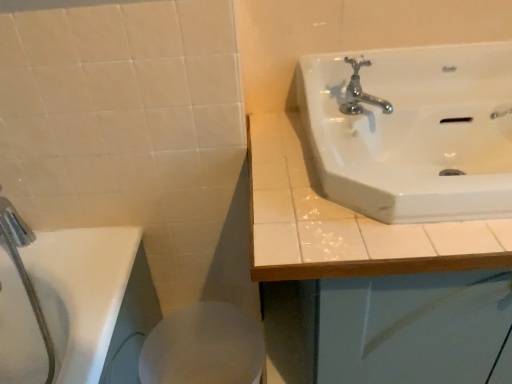
Question: Considering the relative positions of white glossy sink at upper right and white glossy sink at upper right in the image provided, is white glossy sink at upper right to the left or to the right of white glossy sink at upper right?

Choices:
 (A) left
 (B) right

Answer: (B)

Question: Looking at their shapes, would you say white glossy sink at upper right is wider or thinner than white glossy sink at upper right?

Choices:
 (A) thin
 (B) wide

Answer: (B)

Question: Estimate the real-world distances between objects in this image. Which object is closer to the chrome metallic faucet at upper right?

Choices:
 (A) white glossy sink at upper right
 (B) white glossy bidet at lower center
 (C) white glossy sink at upper right

Answer: (C)

Question: Considering the real-world distances, which object is closest to the white glossy sink at upper right?

Choices:
 (A) chrome metallic faucet at upper right
 (B) white glossy bidet at lower center
 (C) white glossy sink at upper right

Answer: (C)